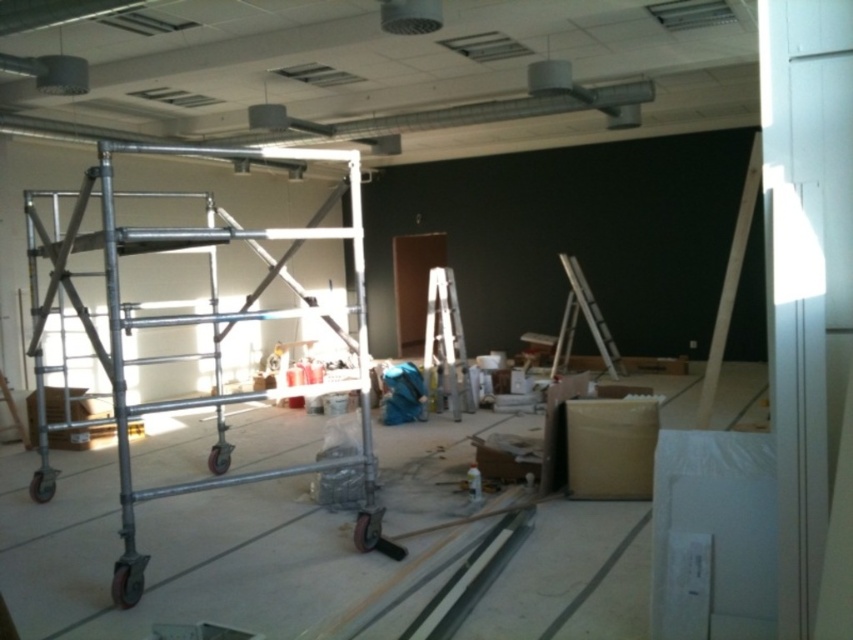
You are a construction worker needing to move from the silver metallic scaffolding at left to the silver metallic ladder at center. Which direction should you move to reach the ladder?

The silver metallic scaffolding at left is to the left of the silver metallic ladder at center, so you should move to the right to reach the ladder.

You are a construction worker who needs to move a tool from the silver metallic scaffolding at left to the metallic silver ladder at center right. Which object is closer to the left side of the room?

The silver metallic scaffolding at left is closer to the left side of the room because it is positioned to the left of the metallic silver ladder at center right.

You are a construction worker needing to reach the ceiling, which is 8 meters high. You have a silver metallic ladder at center. Can you safely reach the ceiling with this ladder?

The silver metallic ladder at center is 7.65 meters in height. Since the ceiling is 8 meters high, the ladder is 35 centimeters too short to safely reach the ceiling.